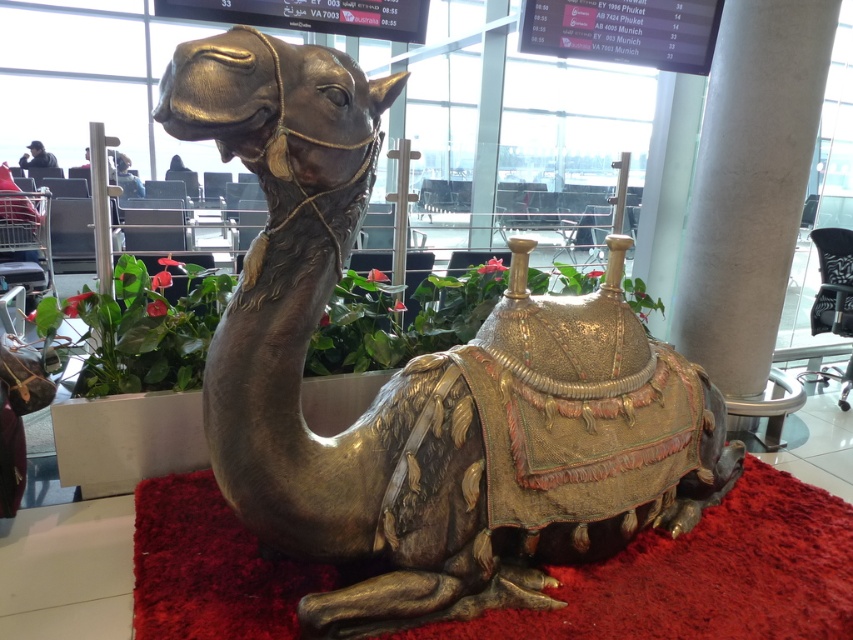
You are a traveler who just arrived at the airport and see the gold metallic camel at center and the shiny metallic mat at center. Which object is closer to you?

The gold metallic camel at center is closer to you because it is in front of the shiny metallic mat at center.

You are standing in the airport terminal and see the gold metallic camel at center. Where exactly is it located in relation to the point marked at coordinates [422,380]?

The gold metallic camel at center is located exactly at the point marked at coordinates [422,380].

You are a traveler who just entered the airport terminal and see the gold metallic camel at center and the shiny metallic mat at center. Which object is bigger in size?

The gold metallic camel at center is larger in size compared to the shiny metallic mat at center.